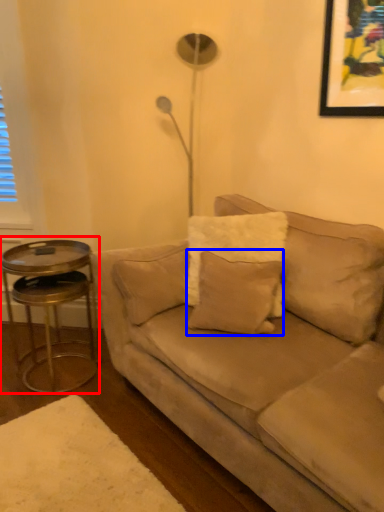
Question: Which point is further to the camera, table (highlighted by a red box) or pillow (highlighted by a blue box)?

Choices:
 (A) table
 (B) pillow

Answer: (A)